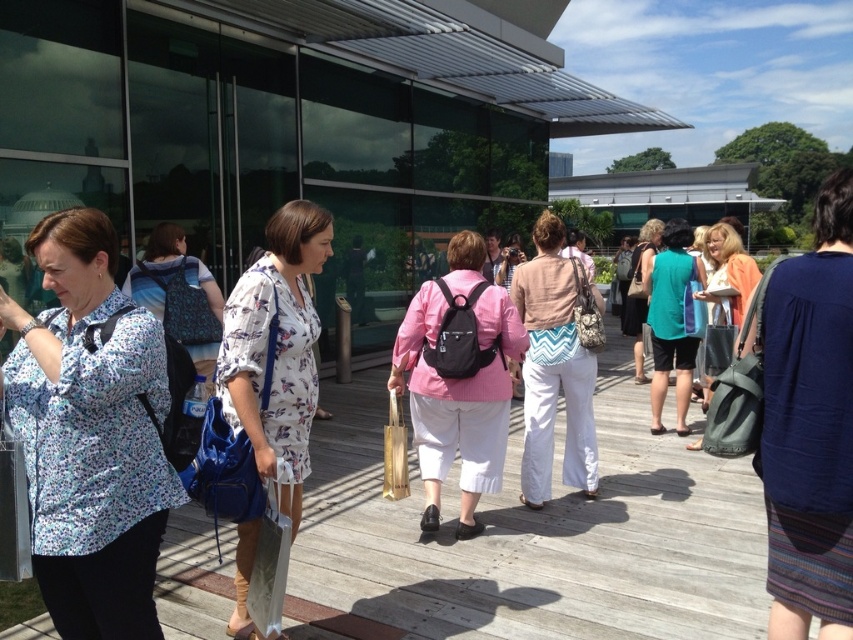
You are organizing a photoshoot and need to place two dresses in the center of a wooden deck. The white floral dress at center and the teal fabric dress at center must be positioned side by side. Which dress should you place on the left to ensure they fit within a 1.5 meter wide space?

The white floral dress at center has a smaller width than the teal fabric dress at center. To fit both within the 1.5 meter space, place the narrower white floral dress at center on the left and the wider teal fabric dress at center next to it, ensuring they occupy the space efficiently without exceeding the width limit.

You are a photographer standing on the wooden deck and want to take a photo of both the printed fabric blouse at left and the matte gray tote bag at center right. Which object should you focus on first to ensure both are in sharp focus?

You should focus on the printed fabric blouse at left first because it is closer to the viewer than the matte gray tote bag at center right, ensuring both will be in focus when focused on the closer object.